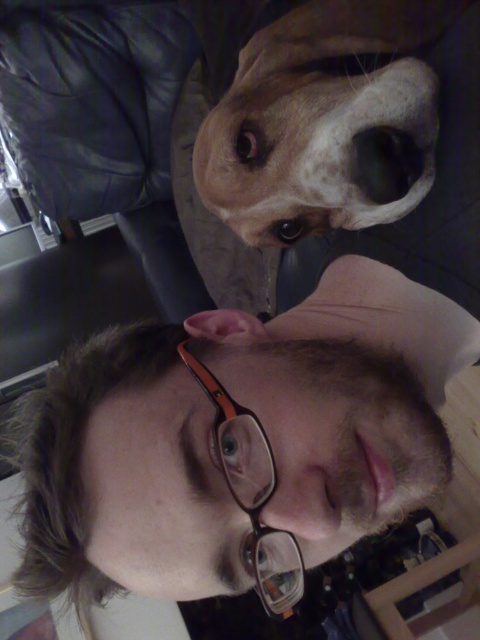
Which is more to the right, brown matte skin at upper center or brown fur dog at upper center?

brown fur dog at upper center

Is brown matte skin at upper center thinner than brown fur dog at upper center?

No, brown matte skin at upper center is not thinner than brown fur dog at upper center.

This screenshot has height=640, width=480. Describe the element at coordinates (240, 436) in the screenshot. I see `brown matte skin at upper center` at that location.

Where is `brown matte skin at upper center`? The image size is (480, 640). brown matte skin at upper center is located at coordinates (240, 436).